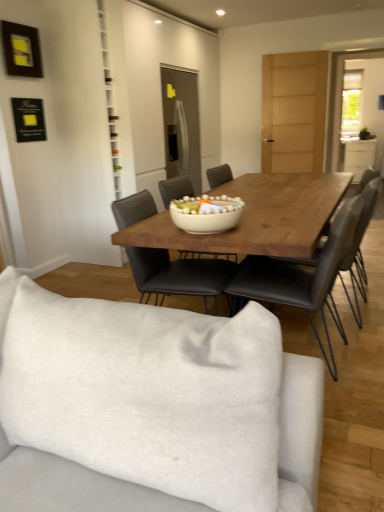
This screenshot has width=384, height=512. I want to click on white glossy cabinet at right, so pos(359,157).

What do you see at coordinates (21, 50) in the screenshot? Image resolution: width=384 pixels, height=512 pixels. I see `wooden picture frame at upper left` at bounding box center [21, 50].

This screenshot has height=512, width=384. What do you see at coordinates (206, 213) in the screenshot?
I see `white glossy bowl at center` at bounding box center [206, 213].

Identify the location of white glossy cabinet at right. (359, 157).

Considering the sizes of objects white fabric studio couch at lower center and white glossy cabinet at right in the image provided, who is bigger, white fabric studio couch at lower center or white glossy cabinet at right?

white fabric studio couch at lower center is bigger.

Does white fabric studio couch at lower center have a lesser width compared to white glossy cabinet at right?

Incorrect, the width of white fabric studio couch at lower center is not less than that of white glossy cabinet at right.

Considering the relative positions of white fabric studio couch at lower center and white glossy cabinet at right in the image provided, is white fabric studio couch at lower center to the left or to the right of white glossy cabinet at right?

white fabric studio couch at lower center is to the left of white glossy cabinet at right.

Is white fabric studio couch at lower center inside or outside of white glossy cabinet at right?

white fabric studio couch at lower center lies outside white glossy cabinet at right.

Which object is closer to the camera, white glossy bowl at center or clear glass door at upper right?

white glossy bowl at center is closer to the camera.

Is point (191, 203) positioned behind point (347, 123)?

No, (191, 203) is closer to viewer.

From a real-world perspective, is white glossy bowl at center below clear glass door at upper right?

Yes, from a real-world perspective, white glossy bowl at center is under clear glass door at upper right.

Looking at this image, considering the sizes of white glossy bowl at center and clear glass door at upper right in the image, is white glossy bowl at center bigger or smaller than clear glass door at upper right?

In the image, white glossy bowl at center appears to be smaller than clear glass door at upper right.

Is clear glass door at upper right surrounded by white fabric studio couch at lower center?

No.

Considering the sizes of white fabric studio couch at lower center and clear glass door at upper right in the image, is white fabric studio couch at lower center wider or thinner than clear glass door at upper right?

white fabric studio couch at lower center is wider than clear glass door at upper right.

Which is behind, point (101, 364) or point (354, 139)?

Point (354, 139)

Considering their positions, is white fabric studio couch at lower center located in front of or behind clear glass door at upper right?

white fabric studio couch at lower center is positioned closer to the viewer than clear glass door at upper right.

Where is `picture frame above the white glossy bowl at center (from a real-world perspective)`? This screenshot has height=512, width=384. picture frame above the white glossy bowl at center (from a real-world perspective) is located at coordinates (21, 50).

Between white glossy bowl at center and wooden picture frame at upper left, which one is positioned in front?

white glossy bowl at center.

From a real-world perspective, relative to wooden picture frame at upper left, is white glossy bowl at center vertically above or below?

From a real-world perspective, white glossy bowl at center is physically below wooden picture frame at upper left.

Based on their sizes in the image, would you say white glossy bowl at center is bigger or smaller than wooden picture frame at upper left?

white glossy bowl at center is bigger than wooden picture frame at upper left.

Locate an element on the screen. The image size is (384, 512). picture frame that appears above the white glossy bowl at center (from the image's perspective) is located at coordinates (21, 50).

Can you confirm if wooden picture frame at upper left is shorter than white glossy bowl at center?

No.

Is wooden picture frame at upper left completely or partially outside of white glossy bowl at center?

Yes.

Considering the positions of objects clear glass door at upper right and white glossy bowl at center in the image provided, who is more to the right, clear glass door at upper right or white glossy bowl at center?

Positioned to the right is clear glass door at upper right.

Between clear glass door at upper right and white glossy bowl at center, which one has smaller width?

Thinner between the two is clear glass door at upper right.

Which is nearer, (356,127) or (221,210)?

Point (356,127) is positioned farther from the camera compared to point (221,210).

From the image's perspective, is clear glass door at upper right located above white glossy bowl at center?

Yes.

How many degrees apart are the facing directions of wooden picture frame at upper left and white glossy cabinet at right?

88.7 degrees.

Can you confirm if wooden picture frame at upper left is positioned to the right of white glossy cabinet at right?

In fact, wooden picture frame at upper left is to the left of white glossy cabinet at right.

Is wooden picture frame at upper left wider than white glossy cabinet at right?

In fact, wooden picture frame at upper left might be narrower than white glossy cabinet at right.

Is point (22, 34) behind point (347, 170)?

No, it is not.

This screenshot has height=512, width=384. Identify the location of studio couch on the left side of white glossy cabinet at right. (152, 407).

Identify the location of glass door above the white glossy bowl at center (from the image's perspective). This screenshot has height=512, width=384. (358, 112).

Looking at the image, which one is located closer to wooden picture frame at upper left, white glossy bowl at center or clear glass door at upper right?

white glossy bowl at center is positioned closer to the anchor wooden picture frame at upper left.

Based on their spatial positions, is clear glass door at upper right or white glossy bowl at center further from wooden picture frame at upper left?

Based on the image, clear glass door at upper right appears to be further to wooden picture frame at upper left.

Considering their positions, is white fabric studio couch at lower center positioned closer to white glossy cabinet at right than white glossy bowl at center?

The object closer to white glossy cabinet at right is white glossy bowl at center.

Which object lies further to the anchor point clear glass door at upper right, white glossy cabinet at right or white fabric studio couch at lower center?

white fabric studio couch at lower center.

Which object lies further to the anchor point white glossy cabinet at right, clear glass door at upper right or white fabric studio couch at lower center?

Among the two, white fabric studio couch at lower center is located further to white glossy cabinet at right.

Based on their spatial positions, is white glossy bowl at center or wooden picture frame at upper left further from white glossy cabinet at right?

white glossy bowl at center is positioned further to the anchor white glossy cabinet at right.

Estimate the real-world distances between objects in this image. Which object is closer to white fabric studio couch at lower center, wooden picture frame at upper left or white glossy cabinet at right?

Among the two, wooden picture frame at upper left is located nearer to white fabric studio couch at lower center.

When comparing their distances from wooden picture frame at upper left, does white fabric studio couch at lower center or white glossy bowl at center seem closer?

white glossy bowl at center is positioned closer to the anchor wooden picture frame at upper left.

The image size is (384, 512). Find the location of `glass door located between white glossy bowl at center and white glossy cabinet at right in the depth direction`. glass door located between white glossy bowl at center and white glossy cabinet at right in the depth direction is located at coordinates (358, 112).

Locate an element on the screen. The image size is (384, 512). picture frame between white fabric studio couch at lower center and white glossy cabinet at right from front to back is located at coordinates (21, 50).

The width and height of the screenshot is (384, 512). Find the location of `bowl between white fabric studio couch at lower center and clear glass door at upper right in the front-back direction`. bowl between white fabric studio couch at lower center and clear glass door at upper right in the front-back direction is located at coordinates (x=206, y=213).

Identify the location of bowl between wooden picture frame at upper left and clear glass door at upper right. The width and height of the screenshot is (384, 512). (x=206, y=213).